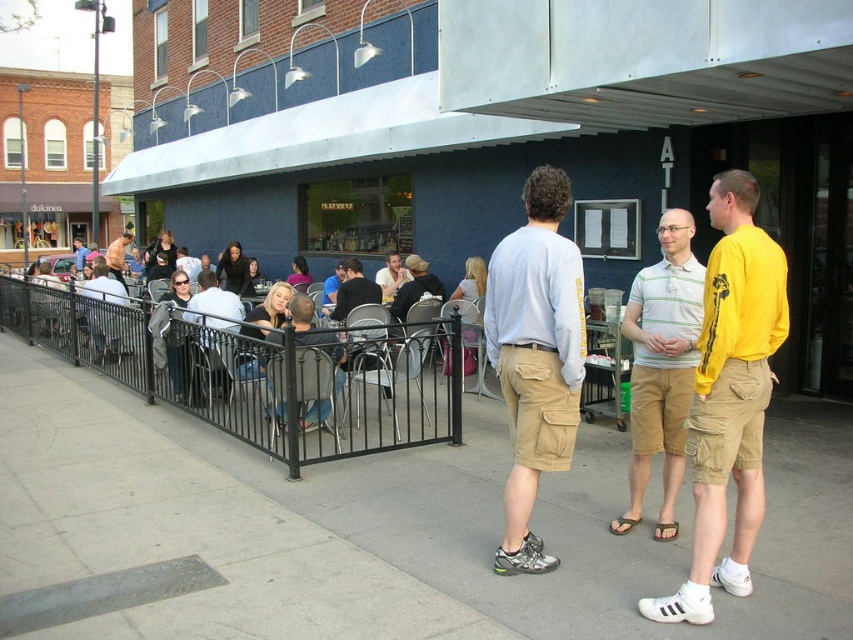
Who is positioned more to the left, yellow cotton shirt at center or light brown leather jacket at center?

light brown leather jacket at center is more to the left.

Does yellow cotton shirt at center appear on the left side of light brown leather jacket at center?

Incorrect, yellow cotton shirt at center is not on the left side of light brown leather jacket at center.

Find the location of a particular element. This screenshot has height=640, width=853. yellow cotton shirt at center is located at coordinates (729, 397).

Who is shorter, gray concrete sidewalk at center or matte black shirt at center?

With less height is gray concrete sidewalk at center.

Locate an element on the screen. gray concrete sidewalk at center is located at coordinates (537, 522).

Is light blue cotton shirt at center taller than black shirt at center?

Indeed, light blue cotton shirt at center has a greater height compared to black shirt at center.

Identify the location of light blue cotton shirt at center. The width and height of the screenshot is (853, 640). (535, 355).

Between point (514, 465) and point (352, 268), which one is positioned in front?

Point (514, 465) is more forward.

Where is `light blue cotton shirt at center`? Image resolution: width=853 pixels, height=640 pixels. light blue cotton shirt at center is located at coordinates (535, 355).